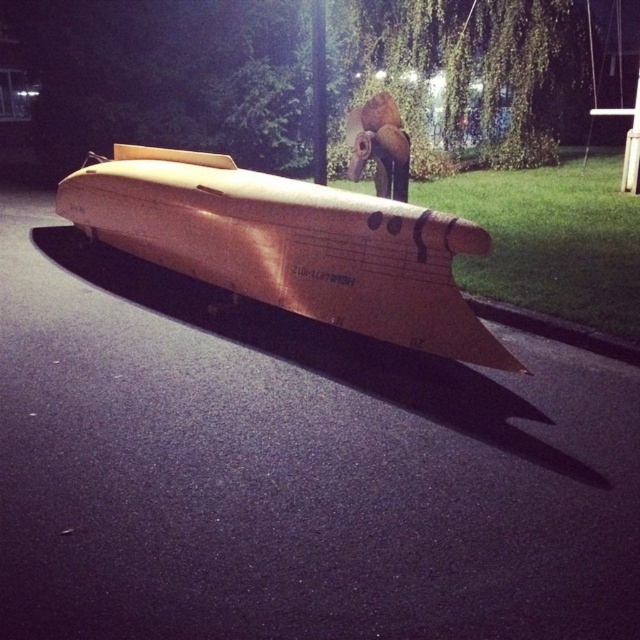
You are a delivery driver who needs to park your truck in the parking lot shown in the image. The truck is 2 meters tall. Can the truck safely pass under the matte gold boat at center without hitting the black asphalt curb at lower right?

The matte gold boat at center is taller than the black asphalt curb at lower right. Since the truck is 2 meters tall, it can safely pass under the matte gold boat at center as long as it stays on the road and avoids the curb.

You are standing at the edge of the black asphalt curb at lower right and want to move towards the matte gold boat at center. Which direction should you face to walk directly towards it?

You should face to the left since the matte gold boat at center is located to the left of the black asphalt curb at lower right.

You are standing at point 0.5, 0.5 in the image. Which direction should you move to reach the matte gold boat at center?

You should move west to reach the matte gold boat at center since it is located at point (x=289, y=244), which is west of your current position at (x=320, y=320).